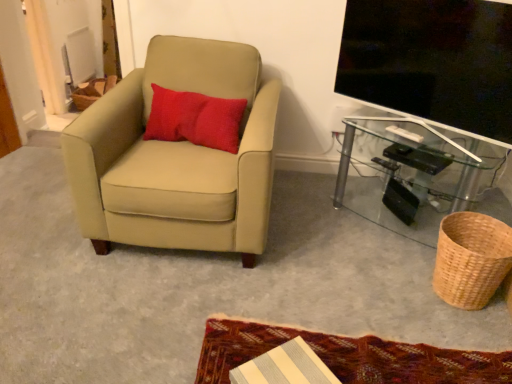
The height and width of the screenshot is (384, 512). What are the coordinates of `free space in front of transparent glass table at lower right` in the screenshot? It's located at (385, 278).